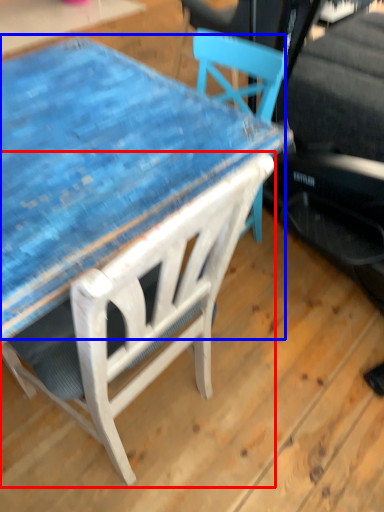
Question: Which object appears farthest to the camera in this image, chair (highlighted by a red box) or table (highlighted by a blue box)?

Choices:
 (A) chair
 (B) table

Answer: (B)